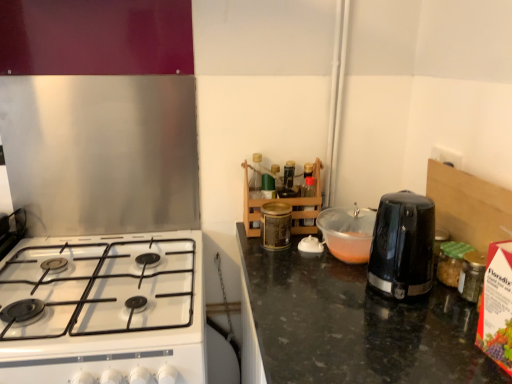
Question: From their relative heights in the image, would you say gold metallic canister at center, which ranks as the 3th kitchen appliance in right-to-left order, is taller or shorter than black plastic kettle at right, which appears as the 3th kitchen appliance when viewed from the left?

Choices:
 (A) short
 (B) tall

Answer: (A)

Question: From a real-world perspective, is gold metallic canister at center, which ranks as the 3th kitchen appliance in right-to-left order, above or below black plastic kettle at right, which appears as the 3th kitchen appliance when viewed from the left?

Choices:
 (A) below
 (B) above

Answer: (A)

Question: Which object is the farthest from the gold metallic canister at center, which ranks as the 3th kitchen appliance in right-to-left order?

Choices:
 (A) black plastic kettle at right, arranged as the 1th kitchen appliance when viewed from the right
 (B) black plastic toaster at center-right, acting as the 2th kitchen appliance starting from the right
 (C) white glossy gas stove at lower left
 (D) wooden rack at center

Answer: (C)

Question: Estimate the real-world distances between objects in this image. Which object is farther from the white glossy gas stove at lower left?

Choices:
 (A) wooden rack at center
 (B) black plastic toaster at center-right, acting as the 2th kitchen appliance starting from the right
 (C) gold metallic canister at center, which appears as the 1th kitchen appliance when viewed from the left
 (D) black plastic kettle at right, arranged as the 1th kitchen appliance when viewed from the right

Answer: (D)